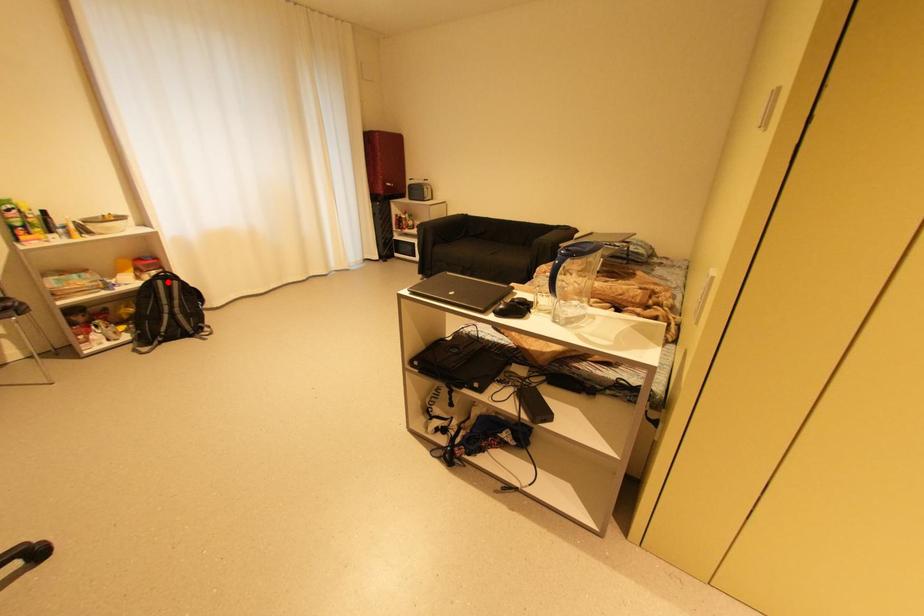
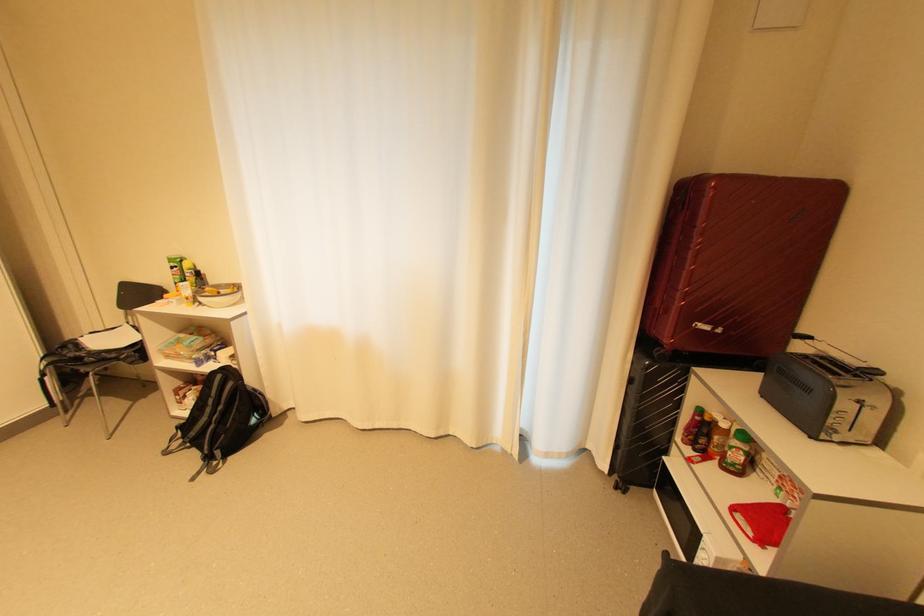
Question: A red point is marked in image1. In image2, is the corresponding 3D point closer to the camera or farther? Reply with the corresponding letter.

Choices:
 (A) The corresponding 3D point is closer.
 (B) The corresponding 3D point is farther.

Answer: (B)